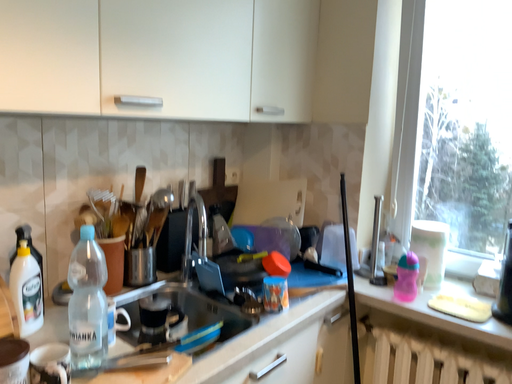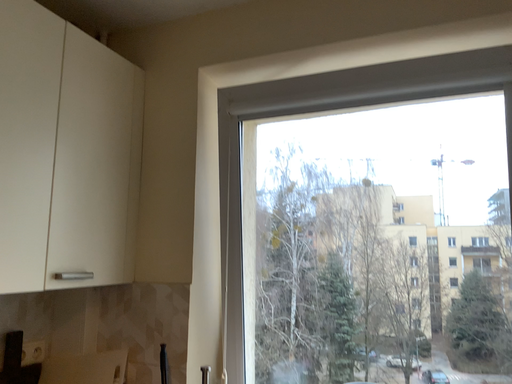
Question: How did the camera likely rotate when shooting the video?

Choices:
 (A) rotated right
 (B) rotated left

Answer: (A)